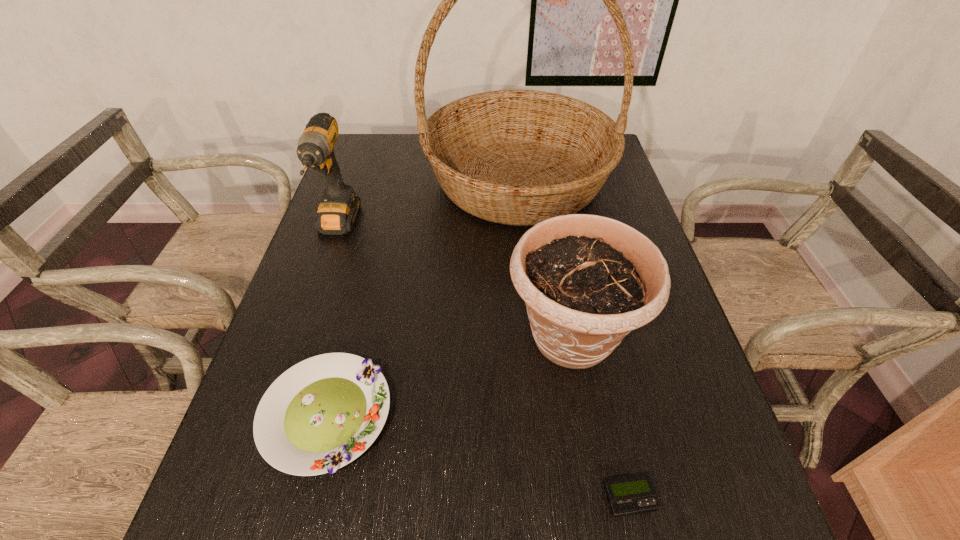
The height and width of the screenshot is (540, 960). In order to click on free space that satisfies the following two spatial constraints: 1. with the drill bit of the fourth shortest object facing forward; 2. on the right side of the beeper in this screenshot , I will do `click(241, 498)`.